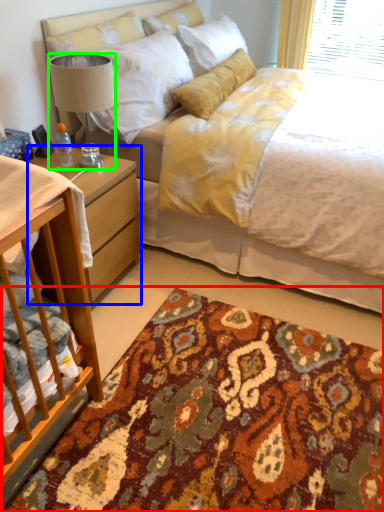
Question: Based on their relative distances, which object is nearer to mat (highlighted by a red box)? Choose from nightstand (highlighted by a blue box) and lamp (highlighted by a green box).

Choices:
 (A) nightstand
 (B) lamp

Answer: (A)